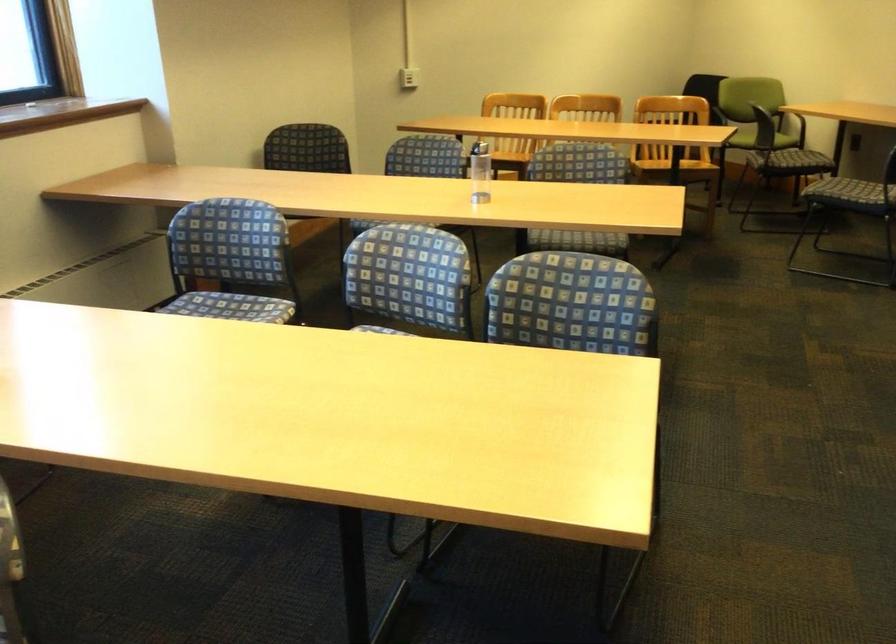
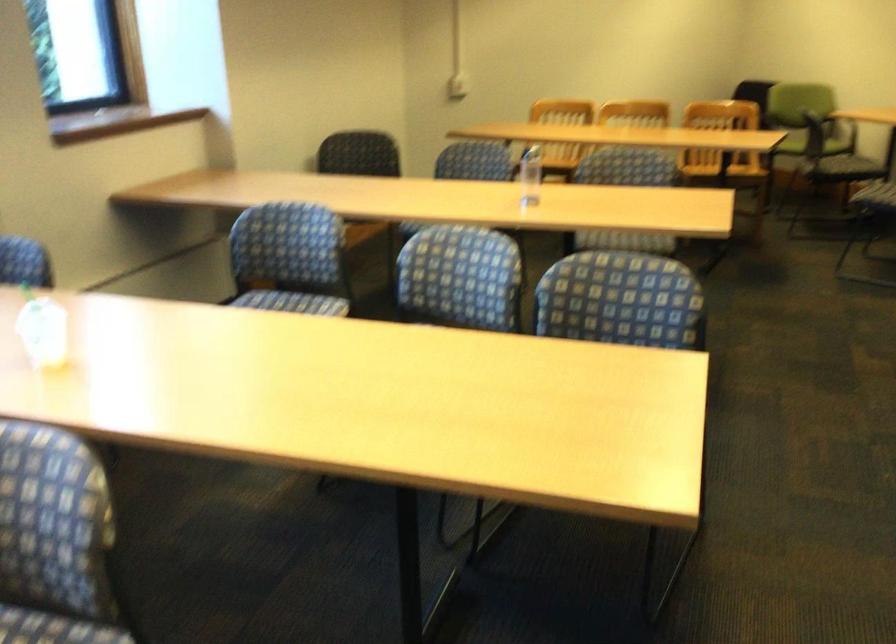
Locate, in the second image, the point that corresponds to [230,258] in the first image.

(289, 259)